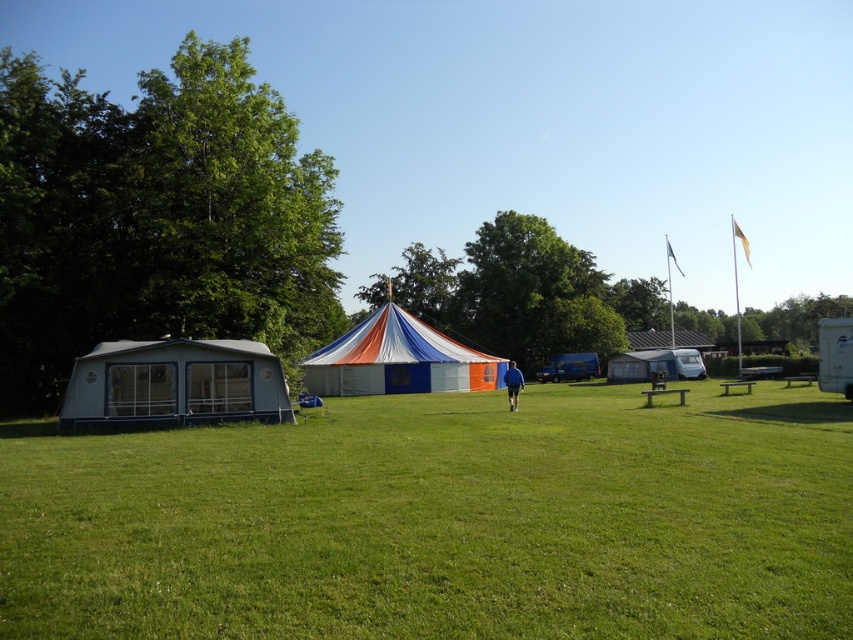
Question: Which point is closer to the camera?

Choices:
 (A) (689, 336)
 (B) (326, 484)

Answer: (B)

Question: Can you confirm if matte blue tent at left is positioned below white corrugated metal hut at center-right?

Choices:
 (A) yes
 (B) no

Answer: (A)

Question: Estimate the real-world distances between objects in this image. Which object is closer to the matte blue tent at left?

Choices:
 (A) white canvas tent at center
 (B) white corrugated metal hut at center-right
 (C) blue fabric person at center
 (D) green grassy field at lower center

Answer: (D)

Question: Does white canvas tent at center come behind white corrugated metal hut at center-right?

Choices:
 (A) yes
 (B) no

Answer: (B)

Question: From the image, what is the correct spatial relationship of matte blue tent at left in relation to blue fabric person at center?

Choices:
 (A) above
 (B) below

Answer: (A)

Question: Estimate the real-world distances between objects in this image. Which object is closer to the matte blue tent at left?

Choices:
 (A) green grassy field at lower center
 (B) blue fabric person at center

Answer: (A)